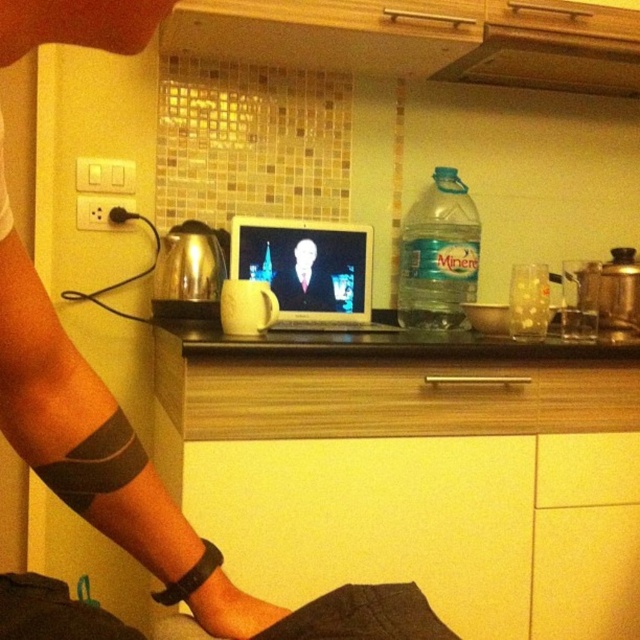
Between point (220, 618) and point (308, 260), which one is positioned behind?

Positioned behind is point (308, 260).

Does matte black laptop at upper center have a greater height compared to smooth skin man at center?

Correct, matte black laptop at upper center is much taller as smooth skin man at center.

Where is `matte black laptop at upper center`? Image resolution: width=640 pixels, height=640 pixels. matte black laptop at upper center is located at coordinates (76, 419).

Find the location of a particular element. matte black laptop at upper center is located at coordinates (76, 419).

Is matte black laptop at upper center to the right of wooden drawer at center from the viewer's perspective?

Incorrect, matte black laptop at upper center is not on the right side of wooden drawer at center.

Is matte black laptop at upper center behind wooden drawer at center?

No, it is in front of wooden drawer at center.

Describe the element at coordinates (76, 419) in the screenshot. I see `matte black laptop at upper center` at that location.

The width and height of the screenshot is (640, 640). In order to click on matte black laptop at upper center in this screenshot , I will do point(76,419).

Is matte black laptop at upper center taller than black glossy laptop at center?

Yes.

Which of these two, matte black laptop at upper center or black glossy laptop at center, stands shorter?

black glossy laptop at center

Is point (92, 522) less distant than point (444, 340)?

Yes.

At what (x,y) coordinates should I click in order to perform the action: click on matte black laptop at upper center. Please return your answer as a coordinate pair (x, y). This screenshot has height=640, width=640. Looking at the image, I should click on (76, 419).